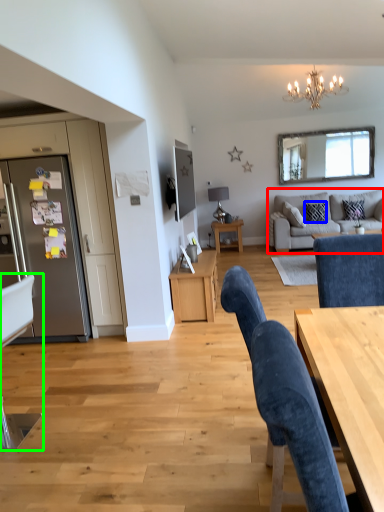
Question: Considering the real-world distances, which object is farthest from studio couch (highlighted by a red box)? pillow (highlighted by a blue box) or chair (highlighted by a green box)?

Choices:
 (A) pillow
 (B) chair

Answer: (B)